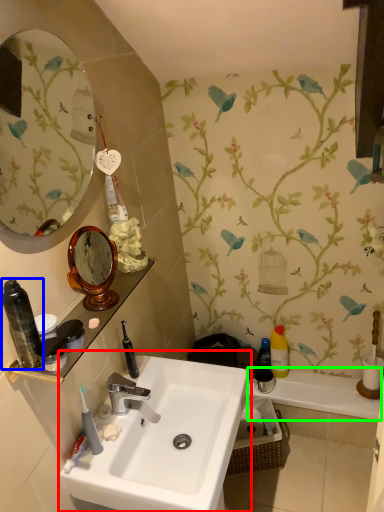
Question: Estimate the real-world distances between objects in this image. Which object is closer to sink (highlighted by a red box), toiletry (highlighted by a blue box) or bath (highlighted by a green box)?

Choices:
 (A) toiletry
 (B) bath

Answer: (A)